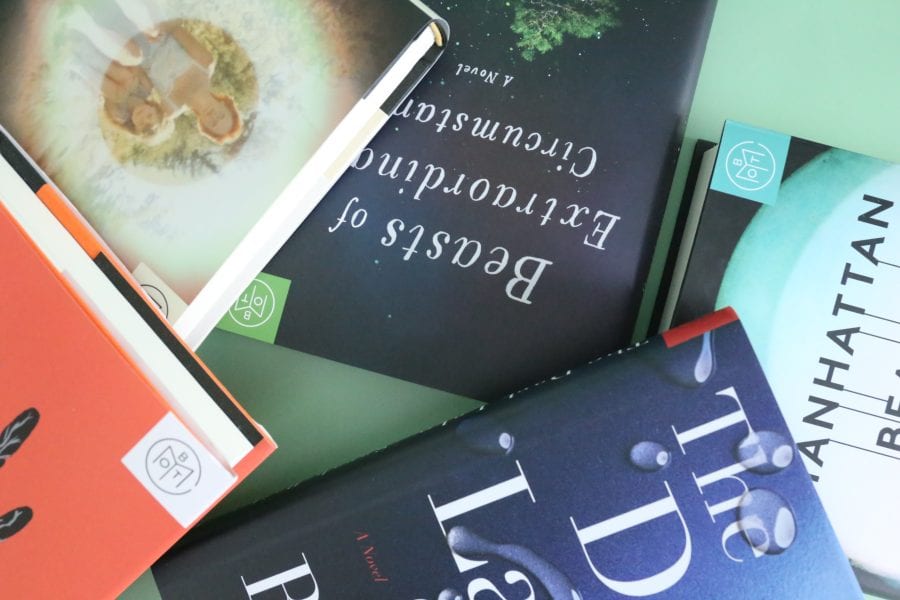
This screenshot has width=900, height=600. In order to click on books in this screenshot , I will do `click(87, 414)`.